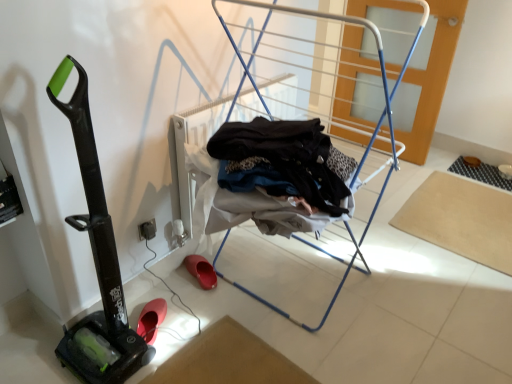
Question: From the image's perspective, is rubber/matte clog at lower left, arranged as the 2th footwear when ordered from the bottom, under rubber/soft sole shoe at lower left, marked as the 1th footwear in a front-to-back arrangement?

Choices:
 (A) yes
 (B) no

Answer: (B)

Question: Is rubber/matte clog at lower left, the 1th footwear from the back, to the right of rubber/soft sole shoe at lower left, which appears as the second footwear when viewed from the back, from the viewer's perspective?

Choices:
 (A) yes
 (B) no

Answer: (A)

Question: Is rubber/matte clog at lower left, the 1th footwear from the back, further to the viewer compared to rubber/soft sole shoe at lower left, which appears as the second footwear when viewed from the back?

Choices:
 (A) yes
 (B) no

Answer: (A)

Question: Considering the relative sizes of rubber/matte clog at lower left, arranged as the 2th footwear when ordered from the bottom, and rubber/soft sole shoe at lower left, which appears as the second footwear when viewed from the back, in the image provided, is rubber/matte clog at lower left, arranged as the 2th footwear when ordered from the bottom, bigger than rubber/soft sole shoe at lower left, which appears as the second footwear when viewed from the back,?

Choices:
 (A) no
 (B) yes

Answer: (B)

Question: Does rubber/matte clog at lower left, which is the first footwear in right-to-left order, come in front of rubber/soft sole shoe at lower left, positioned as the 2th footwear in top-to-bottom order?

Choices:
 (A) yes
 (B) no

Answer: (B)

Question: Does rubber/matte clog at lower left, which is the 2th footwear from front to back, have a greater height compared to rubber/soft sole shoe at lower left, which is the first footwear from left to right?

Choices:
 (A) no
 (B) yes

Answer: (A)

Question: Considering the relative sizes of beige fabric yoga mat at lower right and metallic blue drying rack at center in the image provided, is beige fabric yoga mat at lower right bigger than metallic blue drying rack at center?

Choices:
 (A) yes
 (B) no

Answer: (B)

Question: Is beige fabric yoga mat at lower right wider than metallic blue drying rack at center?

Choices:
 (A) no
 (B) yes

Answer: (B)

Question: Can you confirm if beige fabric yoga mat at lower right is taller than metallic blue drying rack at center?

Choices:
 (A) no
 (B) yes

Answer: (A)

Question: Is beige fabric yoga mat at lower right at the right side of metallic blue drying rack at center?

Choices:
 (A) yes
 (B) no

Answer: (A)

Question: From the image's perspective, would you say beige fabric yoga mat at lower right is shown under metallic blue drying rack at center?

Choices:
 (A) no
 (B) yes

Answer: (B)

Question: Could you tell me if beige fabric yoga mat at lower right is facing metallic blue drying rack at center?

Choices:
 (A) no
 (B) yes

Answer: (A)

Question: Is black rubber vacuum at left at the back of metallic blue drying rack at center?

Choices:
 (A) no
 (B) yes

Answer: (A)